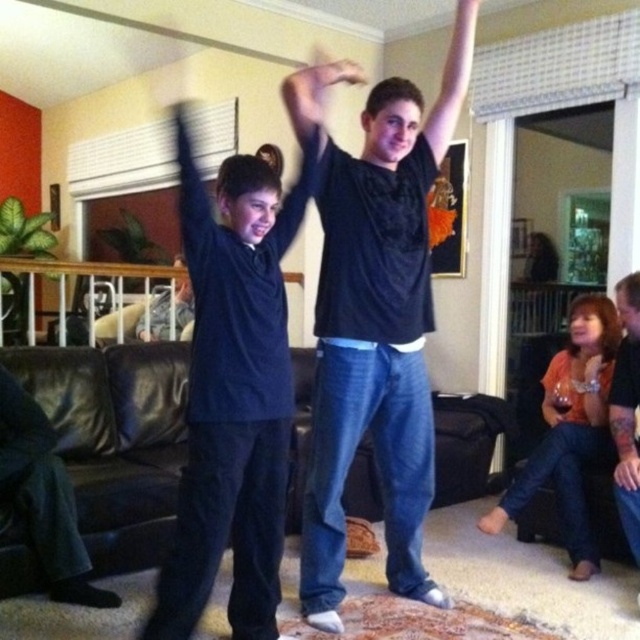
Does dark blue sweater at center have a larger size compared to matte black shirt at center?

Correct, dark blue sweater at center is larger in size than matte black shirt at center.

Is dark blue sweater at center shorter than matte black shirt at center?

In fact, dark blue sweater at center may be taller than matte black shirt at center.

Who is more forward, (188,528) or (305,184)?

Point (188,528)

You are a GUI agent. You are given a task and a screenshot of the screen. Output one action in this format:
    pyautogui.click(x=<x>, y=<y>)
    Task: Click on the dark blue sweater at center
    Image resolution: width=640 pixels, height=640 pixels.
    Given the screenshot: What is the action you would take?
    pyautogui.click(x=237, y=378)

Can you confirm if black matte t-shirt at center is thinner than matte black shirt at center?

In fact, black matte t-shirt at center might be wider than matte black shirt at center.

Can you confirm if black matte t-shirt at center is smaller than matte black shirt at center?

No.

Which is behind, point (344, 349) or point (320, 150)?

Positioned behind is point (344, 349).

In order to click on black matte t-shirt at center in this screenshot , I will do `click(378, 330)`.

The height and width of the screenshot is (640, 640). What do you see at coordinates (308, 125) in the screenshot? I see `matte black shirt at center` at bounding box center [308, 125].

Does matte black shirt at center have a larger size compared to matte black shirt at upper center?

No, matte black shirt at center is not bigger than matte black shirt at upper center.

Which is behind, point (307, 170) or point (433, 134)?

The point (433, 134) is more distant.

You are a GUI agent. You are given a task and a screenshot of the screen. Output one action in this format:
    pyautogui.click(x=<x>, y=<y>)
    Task: Click on the matte black shirt at center
    The image size is (640, 640).
    Given the screenshot: What is the action you would take?
    pyautogui.click(x=308, y=125)